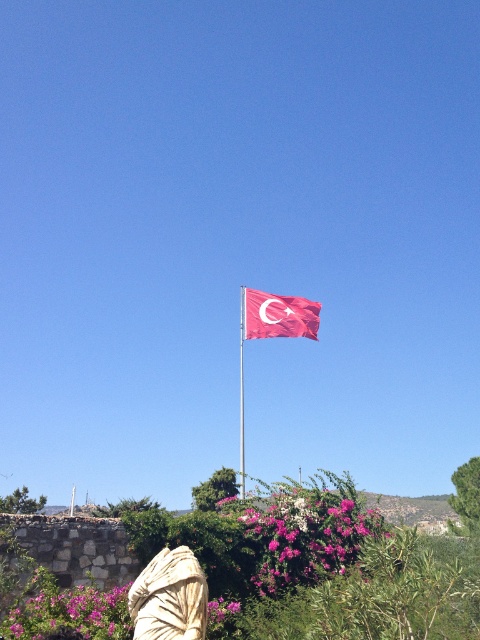
Who is higher up, pink matte flowers at lower center or metallic flag pole at center?

pink matte flowers at lower center is higher up.

Which is in front, point (327, 492) or point (241, 483)?

Positioned in front is point (327, 492).

Does point (216, 580) come farther from viewer compared to point (240, 458)?

No, (216, 580) is in front of (240, 458).

Where is `pink matte flowers at lower center`? The image size is (480, 640). pink matte flowers at lower center is located at coordinates (295, 536).

Between point (333, 541) and point (3, 627), which one is positioned in front?

Point (3, 627)

Who is more distant from viewer, (294, 547) or (87, 616)?

The point (294, 547) is behind.

Does point (322, 516) lie behind point (54, 625)?

Yes.

What are the coordinates of `pink matte flowers at lower center` in the screenshot? It's located at (295, 536).

Between point (162, 632) and point (87, 605), which one is positioned behind?

Positioned behind is point (87, 605).

Who is shorter, beige fabric robe at lower center or pink matte flower at lower left?

pink matte flower at lower left is shorter.

The image size is (480, 640). What are the coordinates of `beige fabric robe at lower center` in the screenshot? It's located at (169, 596).